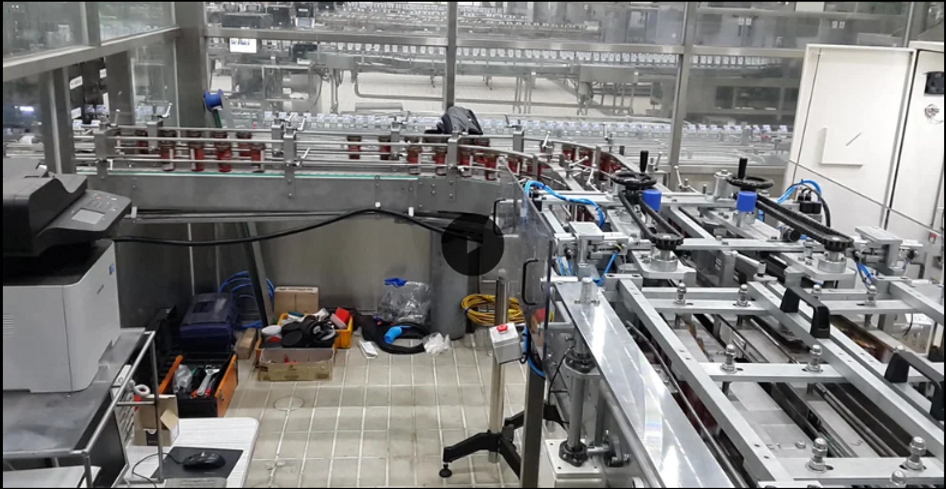
Identify the location of windows. The height and width of the screenshot is (489, 946). (134, 15).